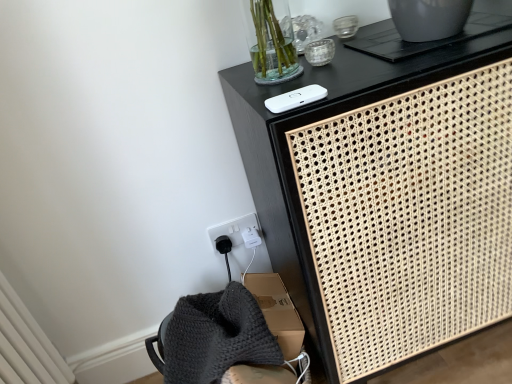
Locate an element on the screen. free space to the back side of white matte ipod at upper center is located at coordinates (302, 78).